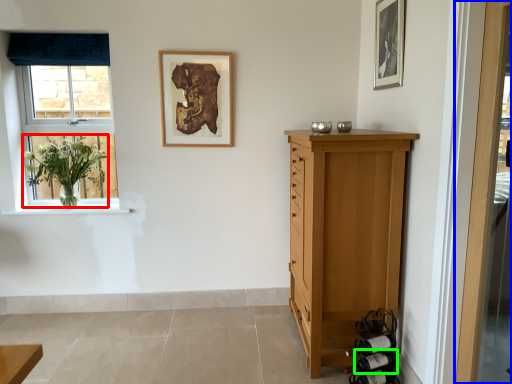
Question: Estimate the real-world distances between objects in this image. Which object is farther from floral arrangement (highlighted by a red box), door (highlighted by a blue box) or wine bottle (highlighted by a green box)?

Choices:
 (A) door
 (B) wine bottle

Answer: (A)